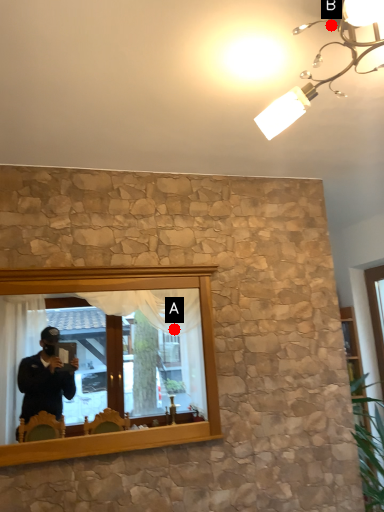
Question: Two points are circled on the image, labeled by A and B beside each circle. Which of the following is the farthest from the observer?

Choices:
 (A) A is further
 (B) B is further

Answer: (A)